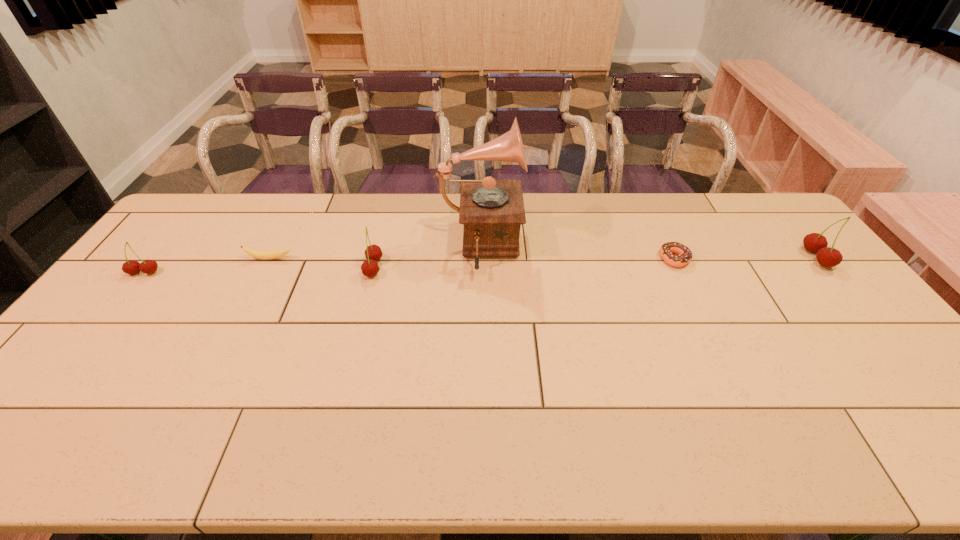
In order to click on object situated at the left edge in this screenshot , I will do `click(131, 267)`.

The height and width of the screenshot is (540, 960). I want to click on object at the right edge, so click(828, 257).

In the image, there is a desktop. Identify the location of vacant space at the far edge. The image size is (960, 540). (540, 212).

Image resolution: width=960 pixels, height=540 pixels. I want to click on free space at the near edge, so click(x=407, y=401).

Locate an element on the screen. The width and height of the screenshot is (960, 540). free space at the right edge of the desktop is located at coordinates (782, 256).

In the image, there is a desktop. What are the coordinates of `vacant space at the near left corner` in the screenshot? It's located at (52, 410).

Locate an element on the screen. This screenshot has height=540, width=960. free space between the fourth shortest object and the fourth object from left to right is located at coordinates (427, 258).

Where is `empty location between the second object from right to left and the rightmost cherry`? This screenshot has width=960, height=540. empty location between the second object from right to left and the rightmost cherry is located at coordinates (745, 258).

Where is `free space that is in between the fifth tallest object and the rightmost object`? The height and width of the screenshot is (540, 960). free space that is in between the fifth tallest object and the rightmost object is located at coordinates (543, 258).

Image resolution: width=960 pixels, height=540 pixels. What are the coordinates of `free space between the shortest cherry and the fourth object from left to right` in the screenshot? It's located at (312, 261).